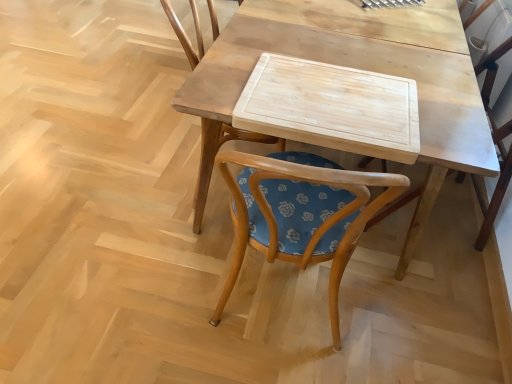
The height and width of the screenshot is (384, 512). In order to click on space that is in front of wooden chair at center, which is counted as the first chair, starting from the left in this screenshot , I will do `click(177, 258)`.